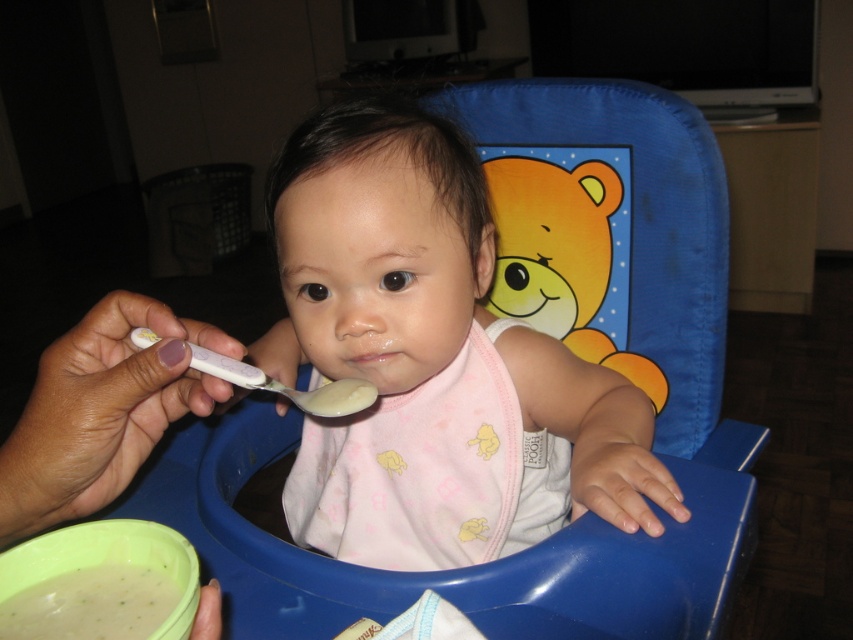
Between point (560, 512) and point (267, 385), which one is positioned in front?

Positioned in front is point (267, 385).

Between point (297, 282) and point (273, 380), which one is positioned in front?

Point (273, 380) is in front.

Identify the location of pink fabric bib at center. The height and width of the screenshot is (640, 853). (433, 360).

Does green creamy soup at lower left have a larger size compared to white plastic spoon at center?

Actually, green creamy soup at lower left might be smaller than white plastic spoon at center.

Is green creamy soup at lower left shorter than white plastic spoon at center?

Yes, green creamy soup at lower left is shorter than white plastic spoon at center.

Who is more distant from viewer, [122,582] or [231,365]?

Positioned behind is point [231,365].

I want to click on green creamy soup at lower left, so click(91, 604).

Is pink fabric bib at center wider than green creamy soup at lower left?

Yes.

Is pink fabric bib at center thinner than green creamy soup at lower left?

No, pink fabric bib at center is not thinner than green creamy soup at lower left.

Is point (546, 445) positioned before point (160, 605)?

No, it is not.

Where is `pink fabric bib at center`? pink fabric bib at center is located at coordinates pyautogui.click(x=433, y=360).